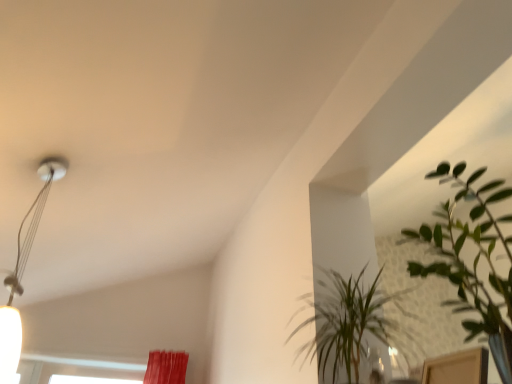
Question: From the image's perspective, is metallic silver lamp at upper left below green leafy plant at upper right, the 1th houseplant in the back-to-front sequence?

Choices:
 (A) no
 (B) yes

Answer: (A)

Question: Is metallic silver lamp at upper left to the right of green leafy plant at upper right, the 1th houseplant in the back-to-front sequence, from the viewer's perspective?

Choices:
 (A) yes
 (B) no

Answer: (B)

Question: Is metallic silver lamp at upper left facing away from green leafy plant at upper right, acting as the second houseplant starting from the front?

Choices:
 (A) no
 (B) yes

Answer: (A)

Question: Considering the relative sizes of metallic silver lamp at upper left and green leafy plant at upper right, the 1th houseplant in the back-to-front sequence, in the image provided, is metallic silver lamp at upper left smaller than green leafy plant at upper right, the 1th houseplant in the back-to-front sequence,?

Choices:
 (A) no
 (B) yes

Answer: (B)

Question: Can you confirm if metallic silver lamp at upper left is bigger than green leafy plant at upper right, the 1th houseplant in the back-to-front sequence?

Choices:
 (A) yes
 (B) no

Answer: (B)

Question: Does metallic silver lamp at upper left lie in front of green leafy plant at upper right, the 1th houseplant in the back-to-front sequence?

Choices:
 (A) yes
 (B) no

Answer: (B)

Question: Would you say green leafy plant at upper right, the first houseplant in the front-to-back sequence, is a long distance from green leafy plant at upper right, acting as the second houseplant starting from the front?

Choices:
 (A) no
 (B) yes

Answer: (A)

Question: From a real-world perspective, is green leafy plant at upper right, the first houseplant in the front-to-back sequence, positioned under green leafy plant at upper right, the 1th houseplant in the back-to-front sequence, based on gravity?

Choices:
 (A) no
 (B) yes

Answer: (B)

Question: Can you confirm if green leafy plant at upper right, the first houseplant in the front-to-back sequence, is positioned to the right of green leafy plant at upper right, acting as the second houseplant starting from the front?

Choices:
 (A) no
 (B) yes

Answer: (B)

Question: Is green leafy plant at upper right, the 2th houseplant viewed from the back, oriented towards green leafy plant at upper right, the 1th houseplant in the back-to-front sequence?

Choices:
 (A) no
 (B) yes

Answer: (A)

Question: Can you confirm if green leafy plant at upper right, the first houseplant in the front-to-back sequence, is taller than green leafy plant at upper right, acting as the second houseplant starting from the front?

Choices:
 (A) no
 (B) yes

Answer: (B)

Question: Is green leafy plant at upper right, the 2th houseplant viewed from the back, next to green leafy plant at upper right, acting as the second houseplant starting from the front?

Choices:
 (A) no
 (B) yes

Answer: (A)

Question: Is green leafy plant at upper right, acting as the second houseplant starting from the front, facing towards metallic silver lamp at upper left?

Choices:
 (A) yes
 (B) no

Answer: (A)